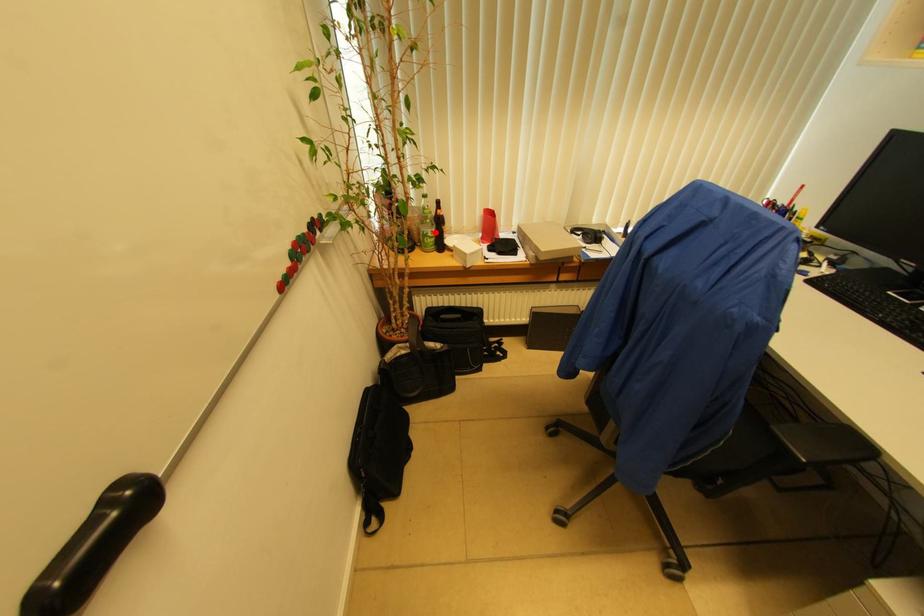
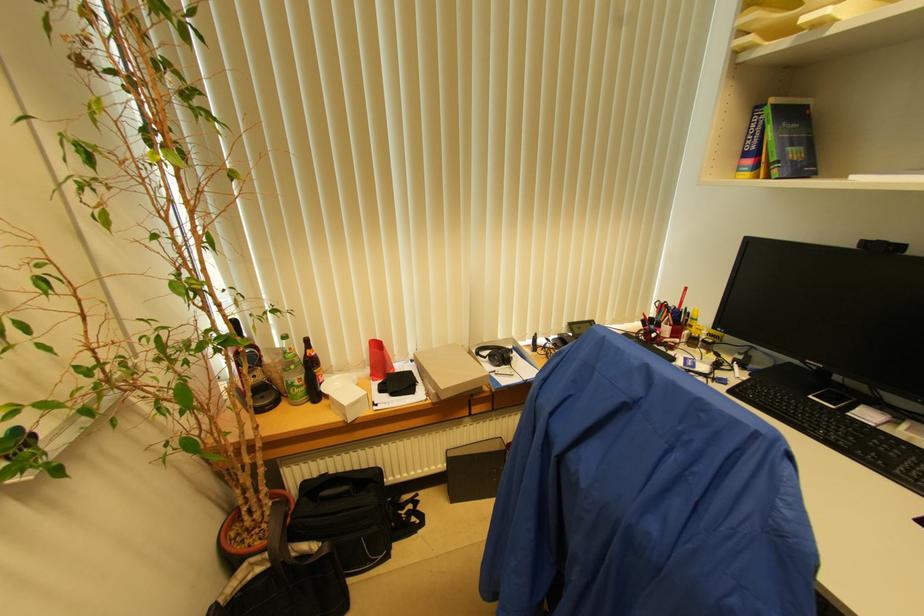
Where in the second image is the point corresponding to the highlighted location from the first image?

(304, 379)